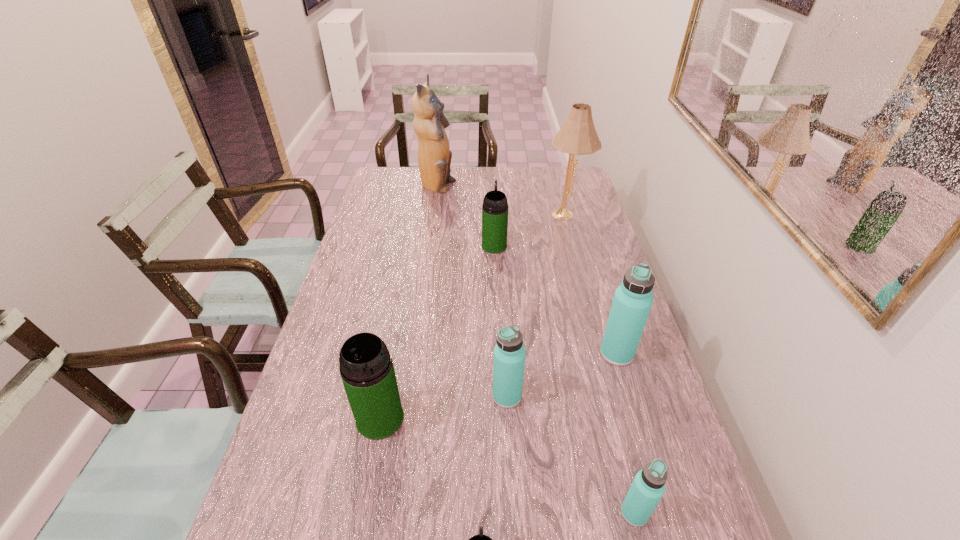
Find the location of `the second smallest aqua thermos bottle`. the second smallest aqua thermos bottle is located at coordinates (509, 353).

This screenshot has height=540, width=960. I want to click on the fifth farthest thermos bottle, so click(648, 486).

The width and height of the screenshot is (960, 540). Identify the location of the smallest aqua thermos bottle. (648, 486).

The width and height of the screenshot is (960, 540). Find the location of `vacant space located 0.240m on the face of the cat`. vacant space located 0.240m on the face of the cat is located at coordinates (513, 187).

Where is `vacant area situated 0.140m on the back of the beige lampshade`? This screenshot has height=540, width=960. vacant area situated 0.140m on the back of the beige lampshade is located at coordinates pos(559,185).

Where is `vacant space situated 0.050m from the spout of the second nearest green thermos bottle`? This screenshot has height=540, width=960. vacant space situated 0.050m from the spout of the second nearest green thermos bottle is located at coordinates (372, 462).

This screenshot has height=540, width=960. I want to click on free spot located 0.280m on the left of the fourth farthest object, so click(496, 354).

Identify the location of vacant space situated 0.090m from the spout of the sixth nearest object. (493, 225).

Locate an element on the screen. free space located 0.170m from the spout of the sixth nearest object is located at coordinates (492, 213).

Locate an element on the screen. Image resolution: width=960 pixels, height=540 pixels. free space located 0.330m from the spout of the sixth nearest object is located at coordinates (492, 192).